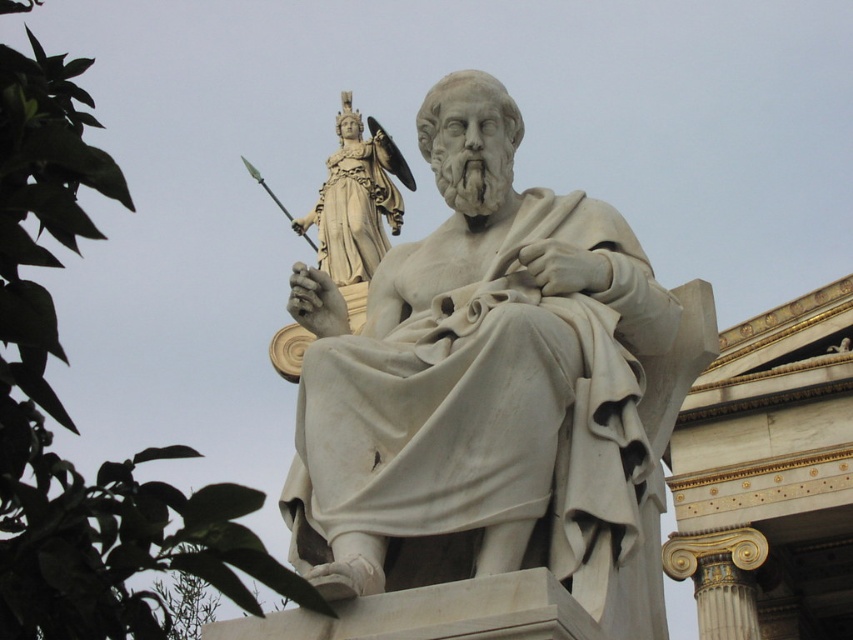
Question: In this image, where is white marble statue at center located relative to golden polished statue at upper center?

Choices:
 (A) above
 (B) below

Answer: (B)

Question: Which point appears farthest from the camera in this image?

Choices:
 (A) (323, 256)
 (B) (412, 509)

Answer: (A)

Question: In this image, where is white marble statue at center located relative to golden polished statue at upper center?

Choices:
 (A) above
 (B) below

Answer: (B)

Question: Which point is closer to the camera?

Choices:
 (A) (375, 316)
 (B) (344, 138)

Answer: (A)

Question: From the image, what is the correct spatial relationship of white marble statue at center in relation to golden polished statue at upper center?

Choices:
 (A) right
 (B) left

Answer: (A)